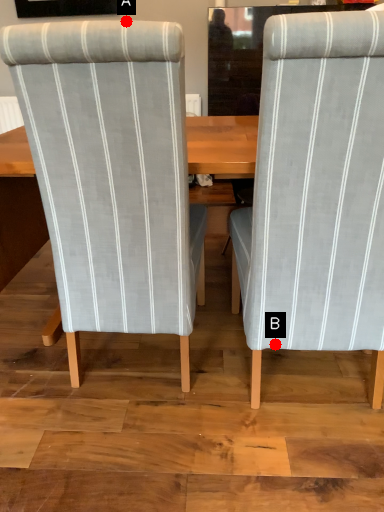
Question: Two points are circled on the image, labeled by A and B beside each circle. Among these points, which one is farthest from the camera?

Choices:
 (A) A is further
 (B) B is further

Answer: (A)